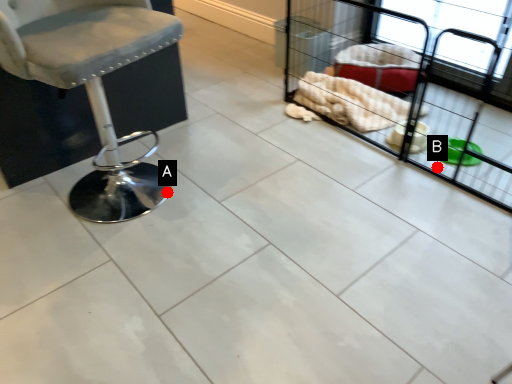
Question: Two points are circled on the image, labeled by A and B beside each circle. Which of the following is the farthest from the observer?

Choices:
 (A) A is further
 (B) B is further

Answer: (B)